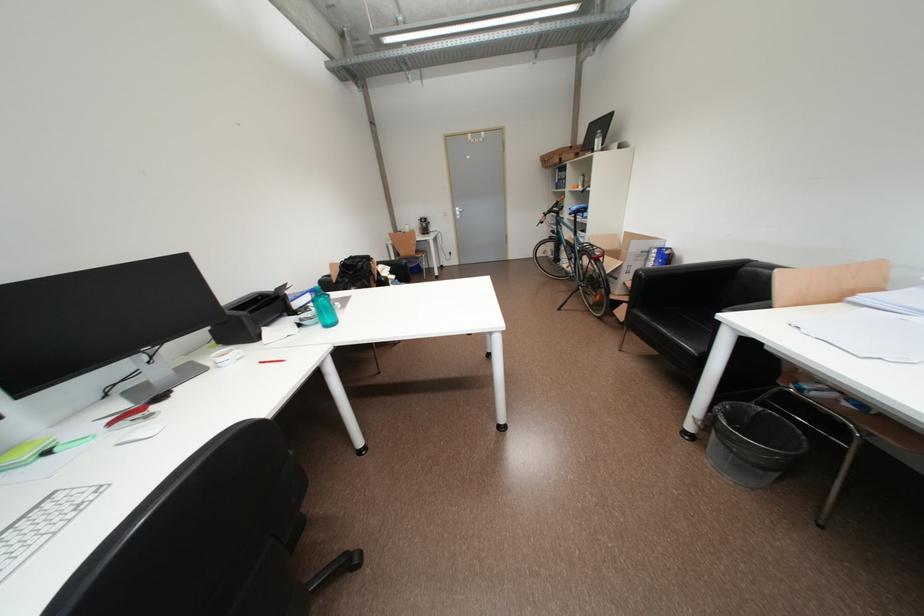
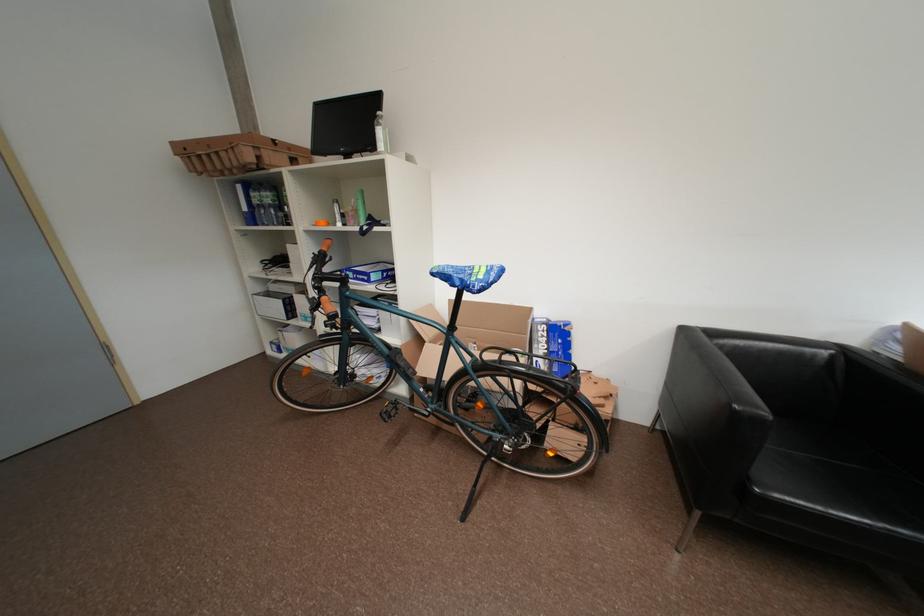
Where in the second image is the point corresponding to (x=663, y=253) from the first image?

(553, 329)